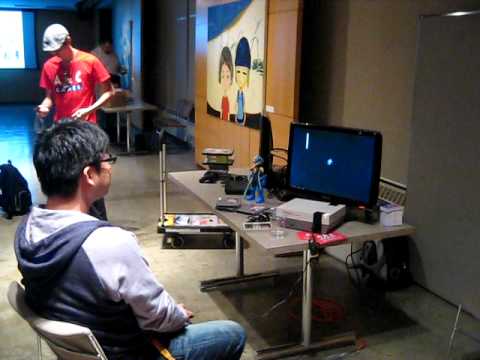
This screenshot has height=360, width=480. I want to click on artwork, so click(228, 65), click(120, 57).